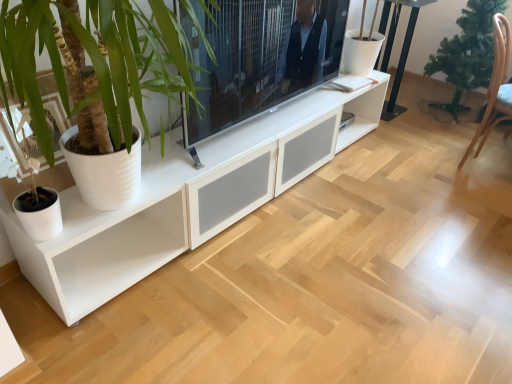
You are a GUI agent. You are given a task and a screenshot of the screen. Output one action in this format:
    pyautogui.click(x=<x>, y=<y>)
    Task: Click on the empty space that is in between black metal table at upper right and green matte christmas tree at right
    This screenshot has width=512, height=384.
    Given the screenshot: What is the action you would take?
    pyautogui.click(x=418, y=117)